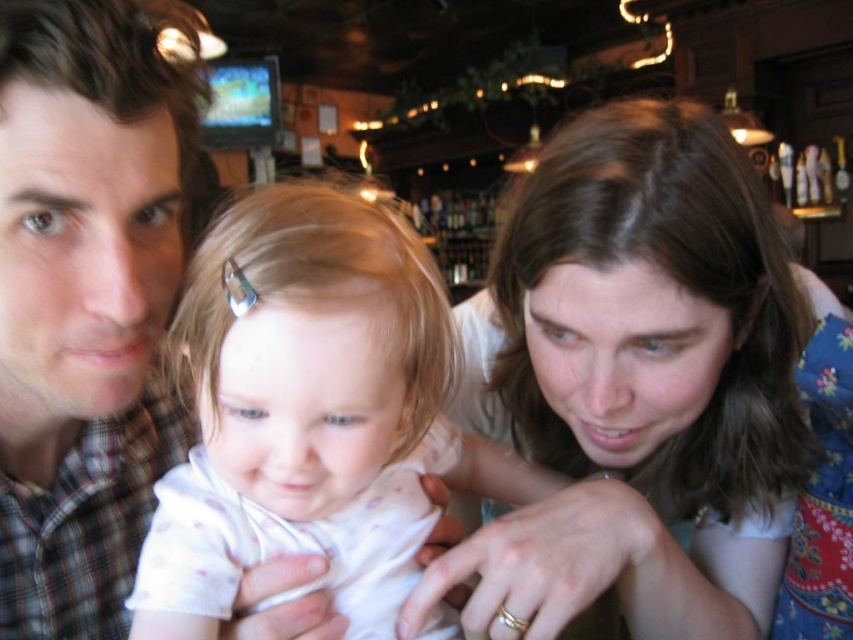
Question: Is smooth brown hair at center positioned in front of white fabric baby at center?

Choices:
 (A) no
 (B) yes

Answer: (A)

Question: Among these objects, which one is farthest from the camera?

Choices:
 (A) smooth brown hair at center
 (B) plaid shirt at left
 (C) white fabric baby at center

Answer: (A)

Question: Which point is farther to the camera?

Choices:
 (A) (700, 326)
 (B) (74, 634)

Answer: (B)

Question: In this image, where is smooth brown hair at center located relative to plaid shirt at left?

Choices:
 (A) above
 (B) below

Answer: (B)

Question: Can you confirm if smooth brown hair at center is wider than white fabric baby at center?

Choices:
 (A) yes
 (B) no

Answer: (A)

Question: Estimate the real-world distances between objects in this image. Which object is closer to the white fabric baby at center?

Choices:
 (A) smooth brown hair at center
 (B) plaid shirt at left

Answer: (B)